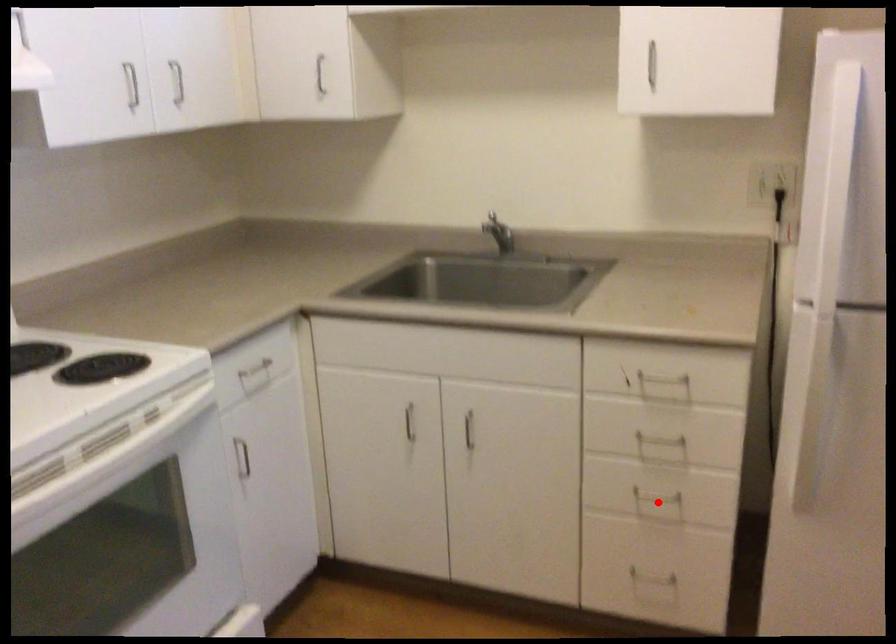
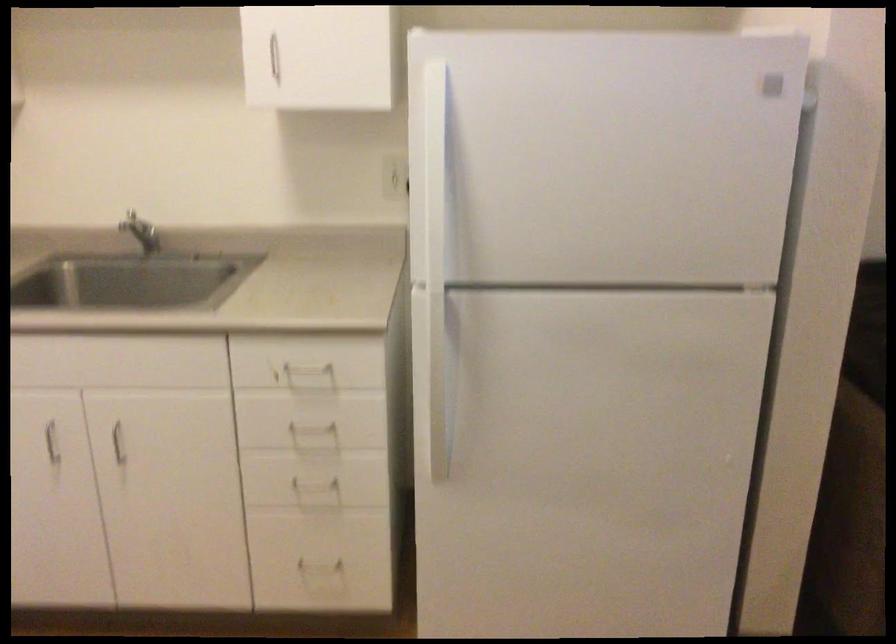
Locate, in the second image, the point that corresponds to the highlighted location in the first image.

(319, 486)